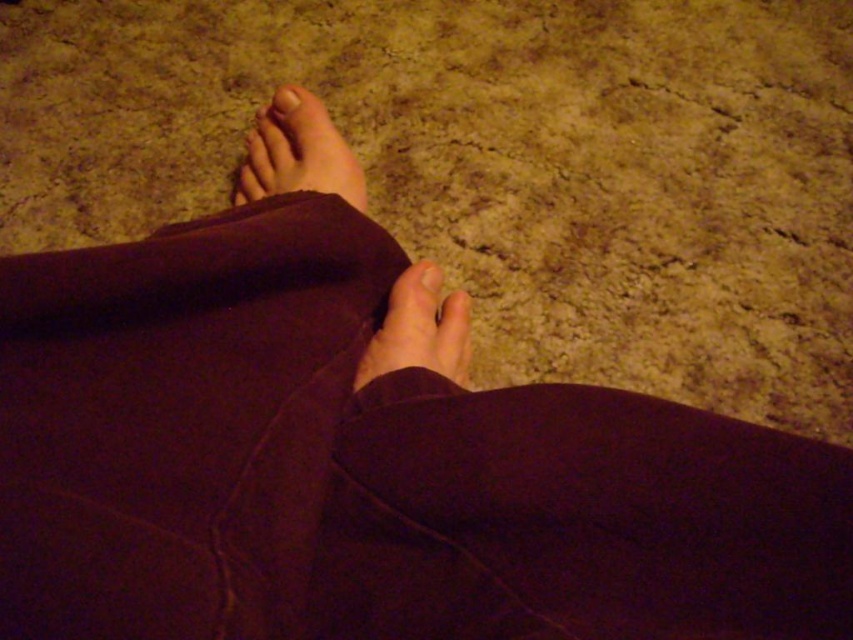
Is point (363, 186) positioned in front of point (381, 326)?

No, it is behind (381, 326).

Can you confirm if matte skin foot at upper center is positioned to the right of smooth skin foot at center?

No, matte skin foot at upper center is not to the right of smooth skin foot at center.

What do you see at coordinates (299, 156) in the screenshot? The width and height of the screenshot is (853, 640). I see `matte skin foot at upper center` at bounding box center [299, 156].

Identify the location of matte skin foot at upper center. (299, 156).

The height and width of the screenshot is (640, 853). Describe the element at coordinates (299, 156) in the screenshot. I see `matte skin foot at upper center` at that location.

Can you confirm if matte skin foot at upper center is shorter than smooth skin toe at center?

In fact, matte skin foot at upper center may be taller than smooth skin toe at center.

Find the location of a particular element. The width and height of the screenshot is (853, 640). matte skin foot at upper center is located at coordinates (299, 156).

Is matte skin foot at upper center below matte skin toe at center?

No.

Does point (279, 140) come farther from viewer compared to point (438, 276)?

Yes, point (279, 140) is farther from viewer.

This screenshot has height=640, width=853. I want to click on matte skin foot at upper center, so click(x=299, y=156).

The height and width of the screenshot is (640, 853). Identify the location of matte skin foot at upper center. (299, 156).